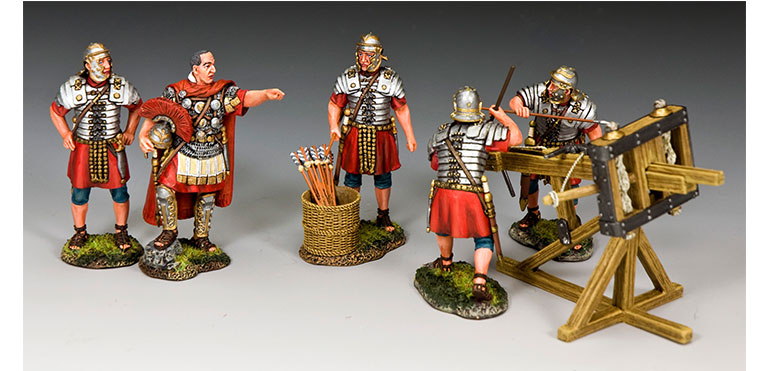
Locate an element on the screen. The height and width of the screenshot is (371, 770). stand is located at coordinates (185, 241).